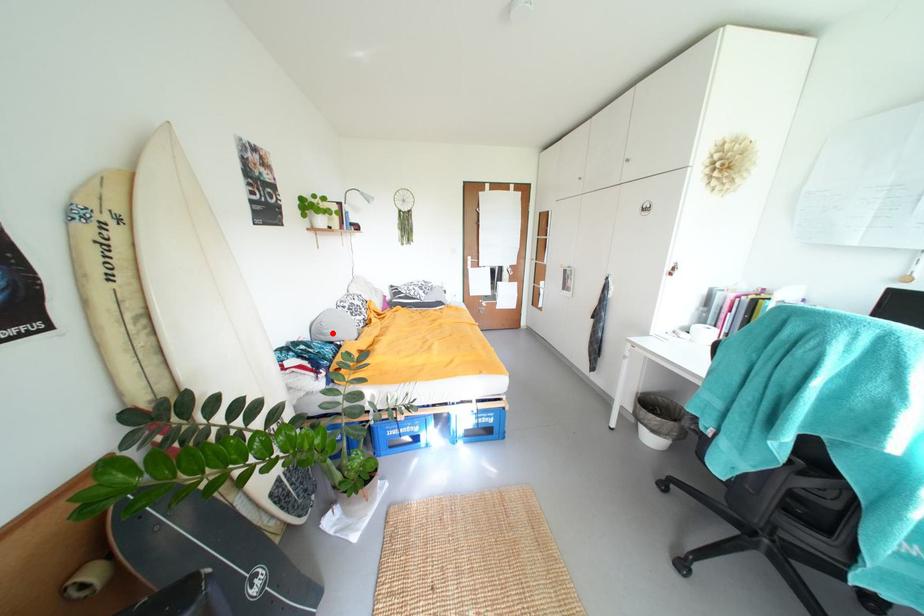
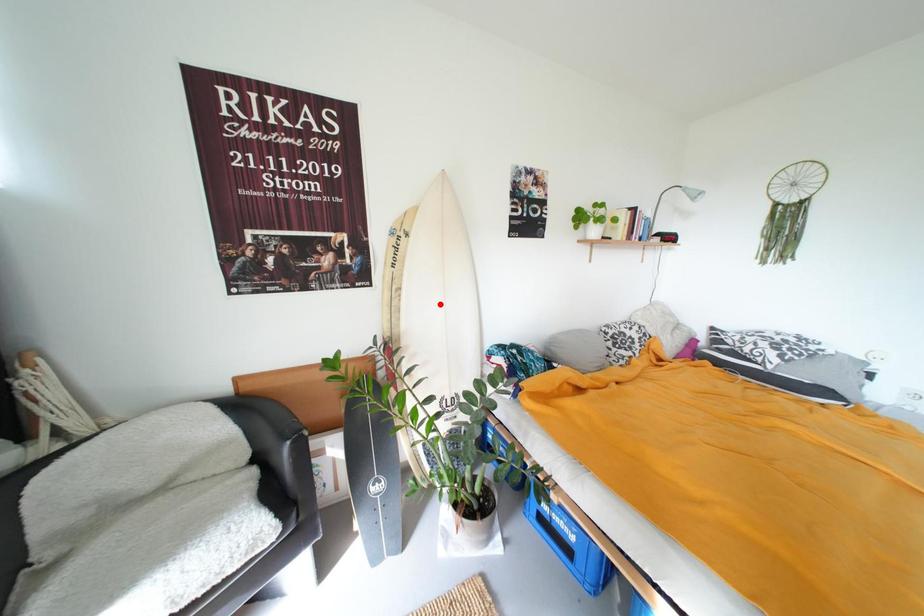
I am providing you with two images of the same scene from different viewpoints. A red point is marked on the first image and another point is marked on the second image. Is the marked point in image1 the same physical position as the marked point in image2?

No